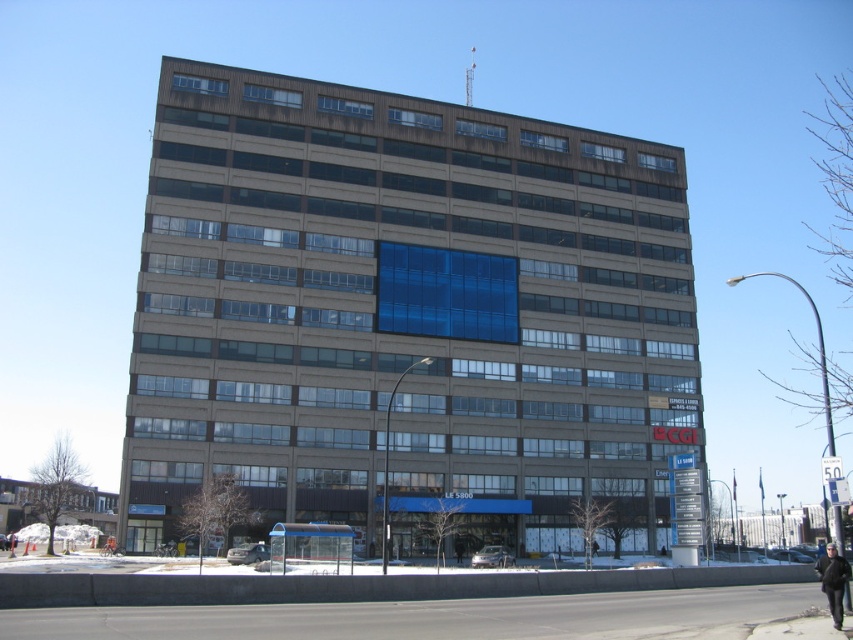
Question: Is black leather jacket at lower right below black leather jacket at lower left?

Choices:
 (A) no
 (B) yes

Answer: (A)

Question: Is black leather jacket at lower right below black leather jacket at lower left?

Choices:
 (A) no
 (B) yes

Answer: (A)

Question: Which of the following is the farthest from the observer?

Choices:
 (A) (15, 536)
 (B) (843, 570)

Answer: (A)

Question: In this image, where is black leather jacket at lower right located relative to black leather jacket at lower left?

Choices:
 (A) above
 (B) below

Answer: (A)